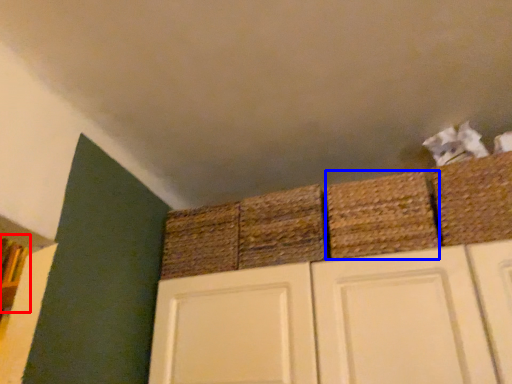
Question: Which of the following is the farthest to the observer, shelf (highlighted by a red box) or basket (highlighted by a blue box)?

Choices:
 (A) shelf
 (B) basket

Answer: (A)